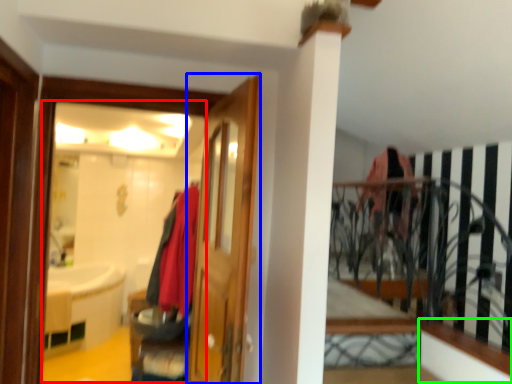
Question: Considering the real-world distances, which object is closest to mirror (highlighted by a red box)? door (highlighted by a blue box) or ledge (highlighted by a green box).

Choices:
 (A) door
 (B) ledge

Answer: (A)